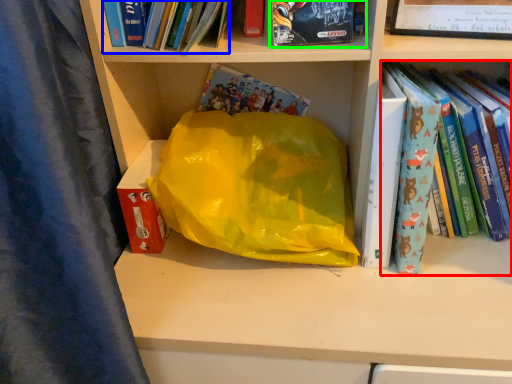
Question: Which object is positioned closest to book (highlighted by a red box)? Select from book (highlighted by a blue box) and book (highlighted by a green box).

Choices:
 (A) book
 (B) book

Answer: (B)